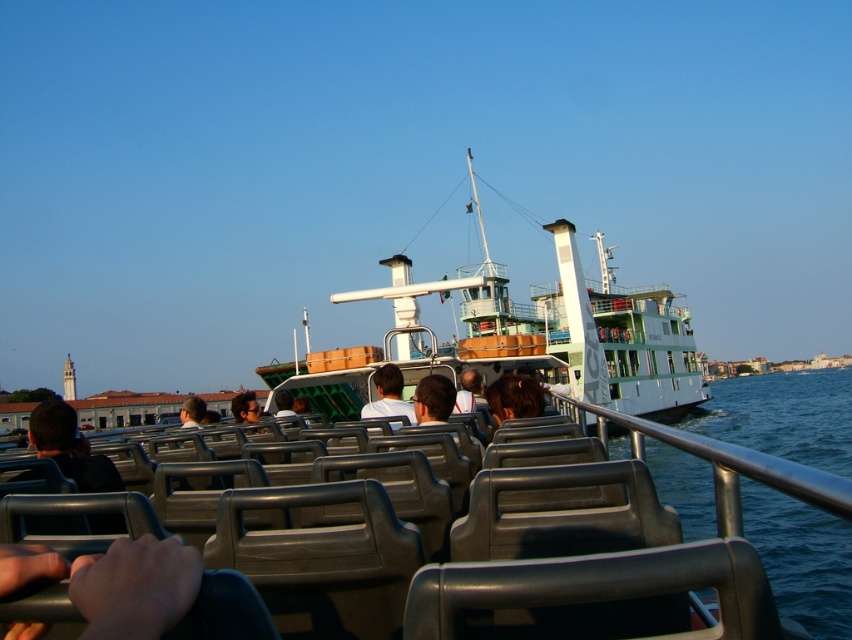
You are a photographer taking a picture of the scene inside the water tram. You notice two elements at the center of your viewfinder. Which one is positioned to the right side of the other? The elements are the white matte shirt at center and the dark brown hair at center.

The white matte shirt at center is to the right of the dark brown hair at center.

You are a passenger on the water tram and want to take a photo of both the green matte ferry at center and the white matte shirt at center through the open top. Can you fit both in the frame without moving your camera?

The green matte ferry at center is taller than the white matte shirt at center, so if you position your camera to include the full height of the green matte ferry at center, the white matte shirt at center should also fit in the frame since it is shorter.

From the picture: You are a passenger sitting inside the water tram and looking out. You notice a green matte ferry at center and a white matte shirt at center. Which object is located to the right of the other?

The green matte ferry at center is positioned on the right side of white matte shirt at center.